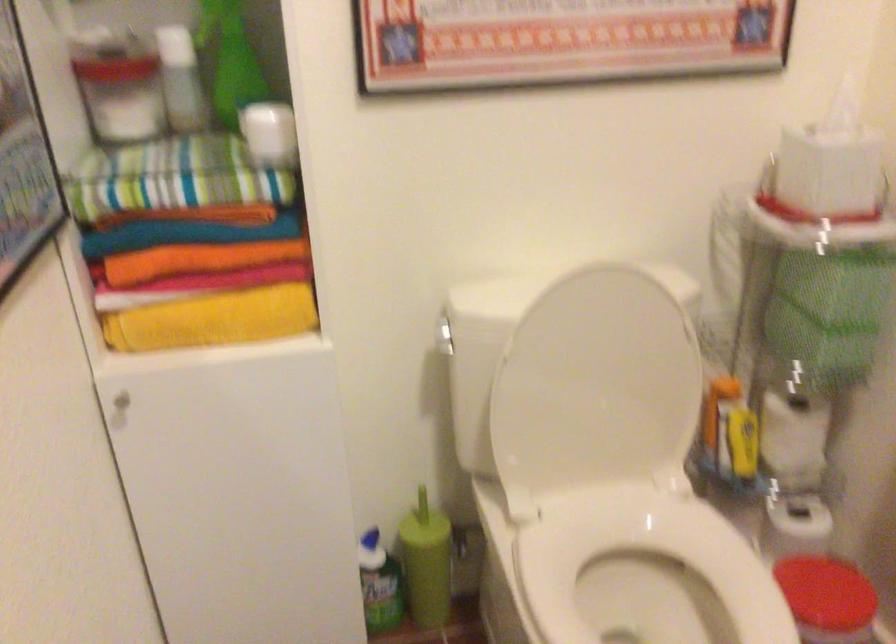
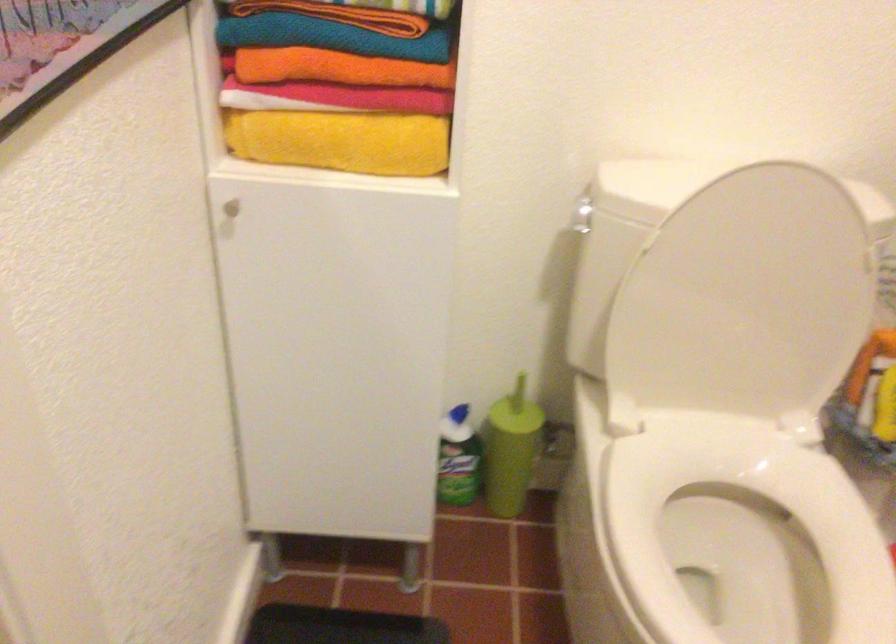
Locate, in the second image, the point that corresponds to point (188, 234) in the first image.

(331, 37)